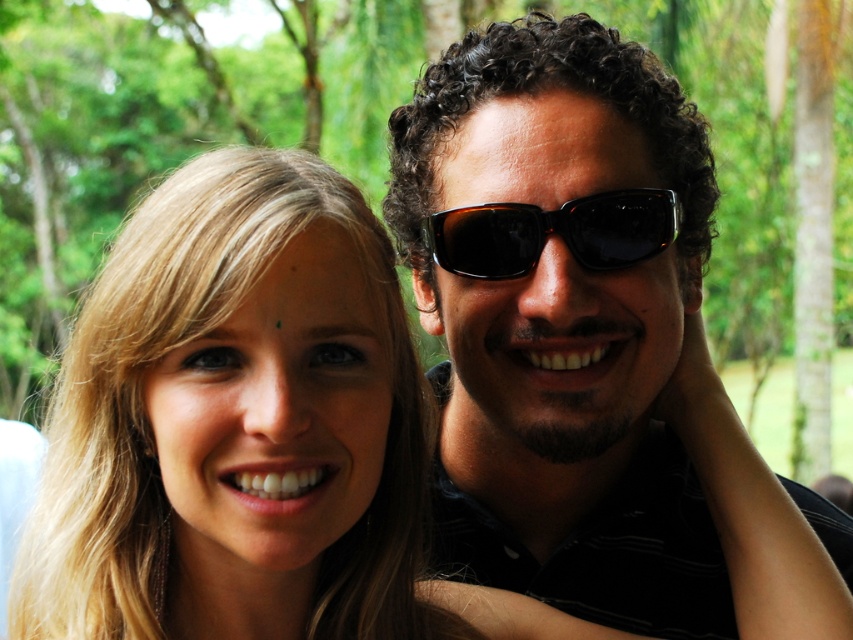
Question: Which of the following is the farthest from the observer?

Choices:
 (A) black plastic sunglasses at center
 (B) blonde hair at center

Answer: (A)

Question: Observing the image, what is the correct spatial positioning of blonde hair at center in reference to black plastic sunglasses at center?

Choices:
 (A) right
 (B) left

Answer: (B)

Question: Can you confirm if blonde hair at center is thinner than black plastic sunglasses at center?

Choices:
 (A) yes
 (B) no

Answer: (B)

Question: Is matte black sunglasses at center closer to camera compared to black plastic sunglasses at center?

Choices:
 (A) yes
 (B) no

Answer: (A)

Question: Which object appears closest to the camera in this image?

Choices:
 (A) blonde hair at center
 (B) matte black sunglasses at center

Answer: (A)

Question: Based on their relative distances, which object is nearer to the matte black sunglasses at center?

Choices:
 (A) black plastic sunglasses at center
 (B) blonde hair at center

Answer: (A)